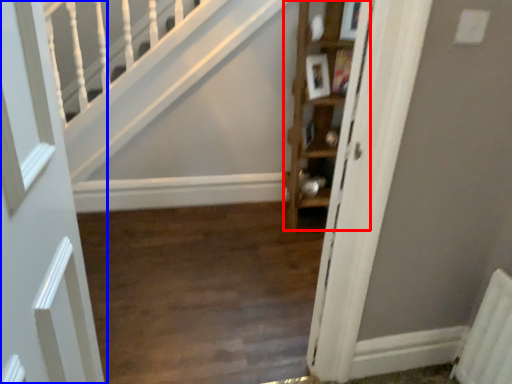
Question: Which of the following is the farthest to the observer, cabinet (highlighted by a red box) or door (highlighted by a blue box)?

Choices:
 (A) cabinet
 (B) door

Answer: (A)